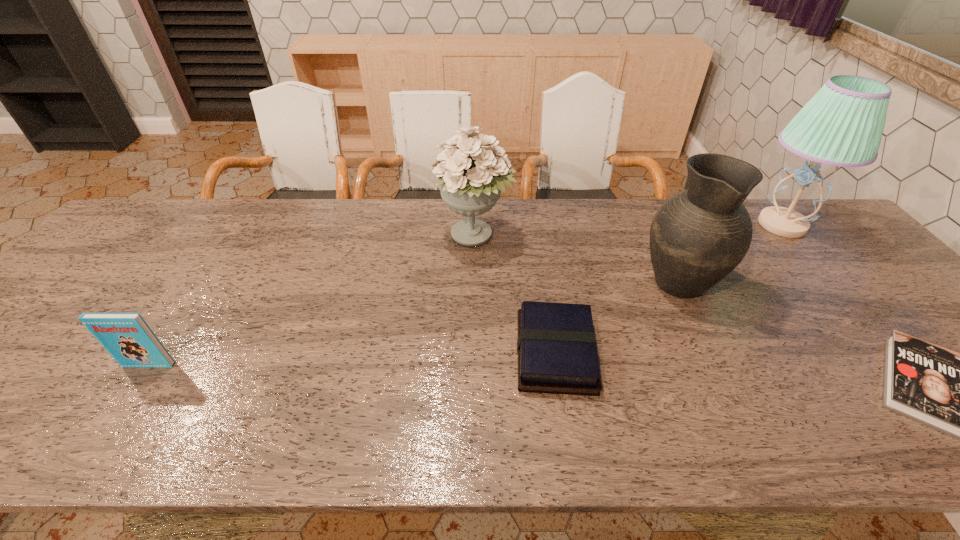
Locate an element on the screen. vacant space at the left edge of the desktop is located at coordinates (120, 247).

Identify the location of unoccupied area between the fifth tallest object and the bouquet. (515, 295).

Image resolution: width=960 pixels, height=540 pixels. What are the coordinates of `vacant space that is in between the leftmost object and the bouquet` in the screenshot? It's located at (312, 301).

Image resolution: width=960 pixels, height=540 pixels. What are the coordinates of `vacant area that lies between the bouquet and the second book from left to right` in the screenshot? It's located at click(x=515, y=295).

I want to click on unoccupied area between the tallest object and the bouquet, so click(629, 231).

This screenshot has height=540, width=960. In order to click on the fifth closest object to the bouquet in this screenshot , I will do `click(959, 394)`.

This screenshot has height=540, width=960. Identify the location of object that is the second closest one to the lamp. (959, 394).

Image resolution: width=960 pixels, height=540 pixels. What are the coordinates of `book that is the nearest to the third object from right to left` in the screenshot? It's located at (556, 346).

This screenshot has height=540, width=960. Identify the location of book that is the second closest to the third shortest object. (959, 394).